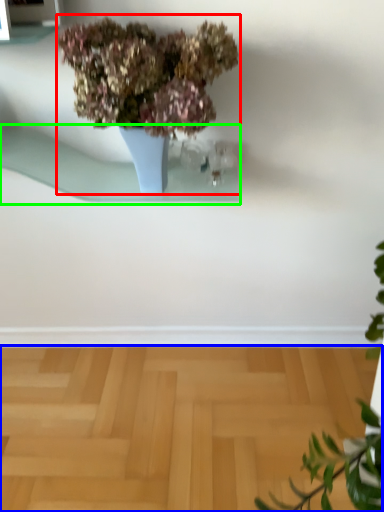
Question: Considering the real-world distances, which object is farthest from houseplant (highlighted by a red box)? surface (highlighted by a blue box) or window sill (highlighted by a green box)?

Choices:
 (A) surface
 (B) window sill

Answer: (A)